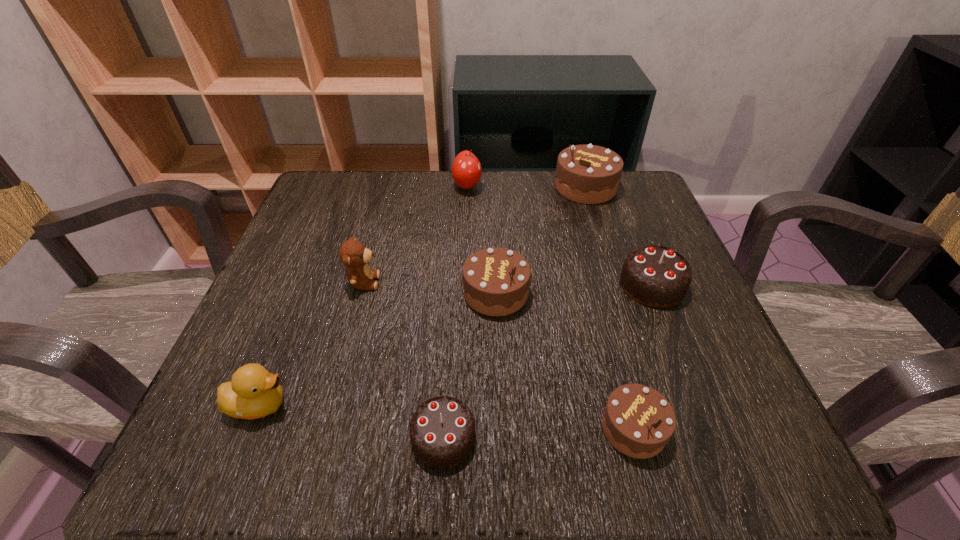
You are a GUI agent. You are given a task and a screenshot of the screen. Output one action in this format:
    pyautogui.click(x=<x>, y=<y>)
    Task: Click on the smallest brown chocolate cake
    This screenshot has height=540, width=960.
    Given the screenshot: What is the action you would take?
    pyautogui.click(x=638, y=421)

The width and height of the screenshot is (960, 540). What are the coordinates of `the nearer chocolate chocolate cake` in the screenshot? It's located at (442, 431).

This screenshot has width=960, height=540. Find the location of `the smaller chocolate chocolate cake`. the smaller chocolate chocolate cake is located at coordinates (442, 431).

Where is `vacant space situated 0.060m on the front of the farthest brown chocolate cake`? The width and height of the screenshot is (960, 540). vacant space situated 0.060m on the front of the farthest brown chocolate cake is located at coordinates (596, 221).

Locate an element on the screen. vacant area located on the left of the apple is located at coordinates (362, 186).

You are a GUI agent. You are given a task and a screenshot of the screen. Output one action in this format:
    pyautogui.click(x=<x>, y=<y>)
    Task: Click on the free space located on the face of the seventh object from right to left
    
    Given the screenshot: What is the action you would take?
    pyautogui.click(x=454, y=282)

Identify the location of vacant space situated 0.350m on the back of the second nearest brown chocolate cake. This screenshot has width=960, height=540. (492, 176).

Where is `vacant space situated on the front of the right chocolate chocolate cake`? vacant space situated on the front of the right chocolate chocolate cake is located at coordinates (676, 345).

Where is `vacant space situated 0.310m facing forward on the duckling`? This screenshot has width=960, height=540. vacant space situated 0.310m facing forward on the duckling is located at coordinates (502, 404).

Where is `vacant point located on the back of the smallest brown chocolate cake`? Image resolution: width=960 pixels, height=540 pixels. vacant point located on the back of the smallest brown chocolate cake is located at coordinates (586, 247).